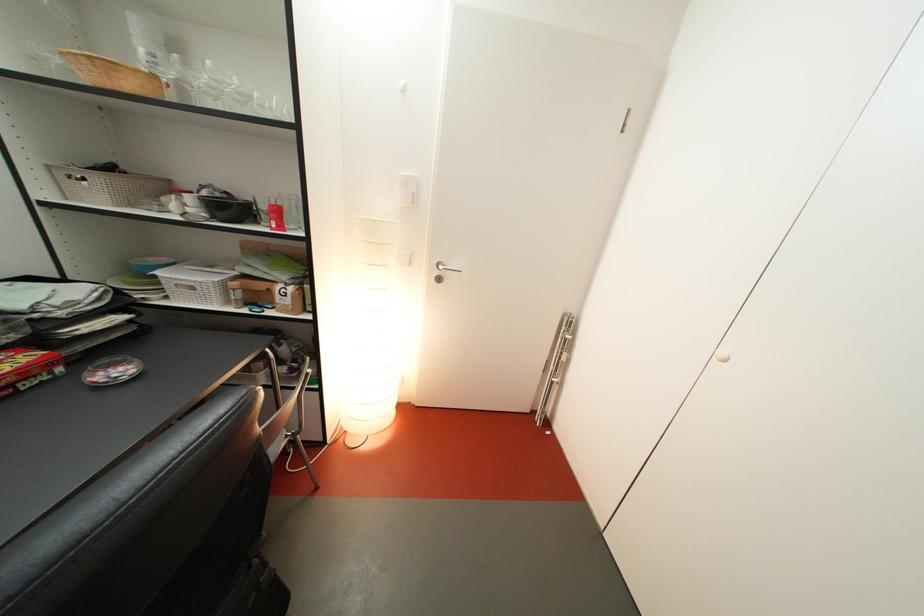
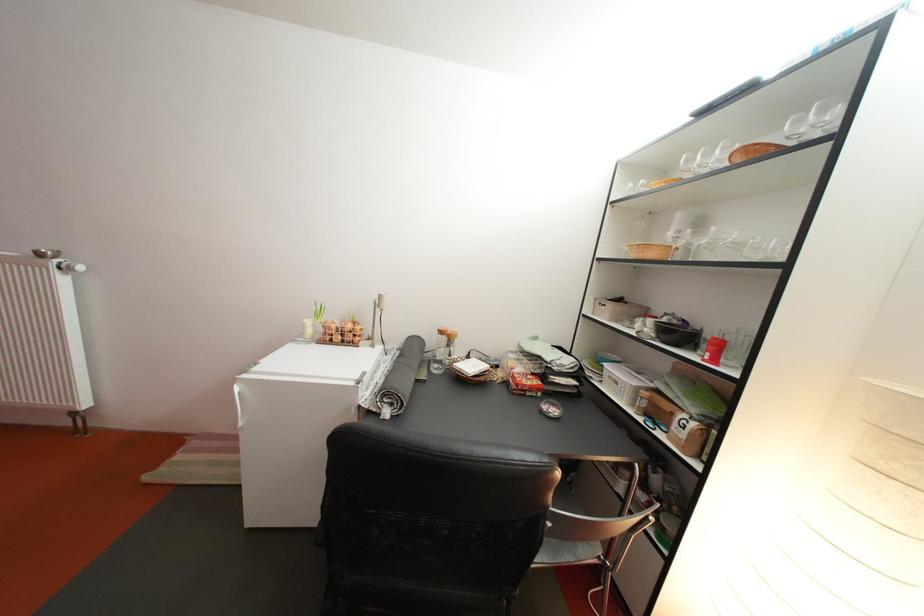
Find the pixel in the second image that matches (122,175) in the first image.

(630, 306)